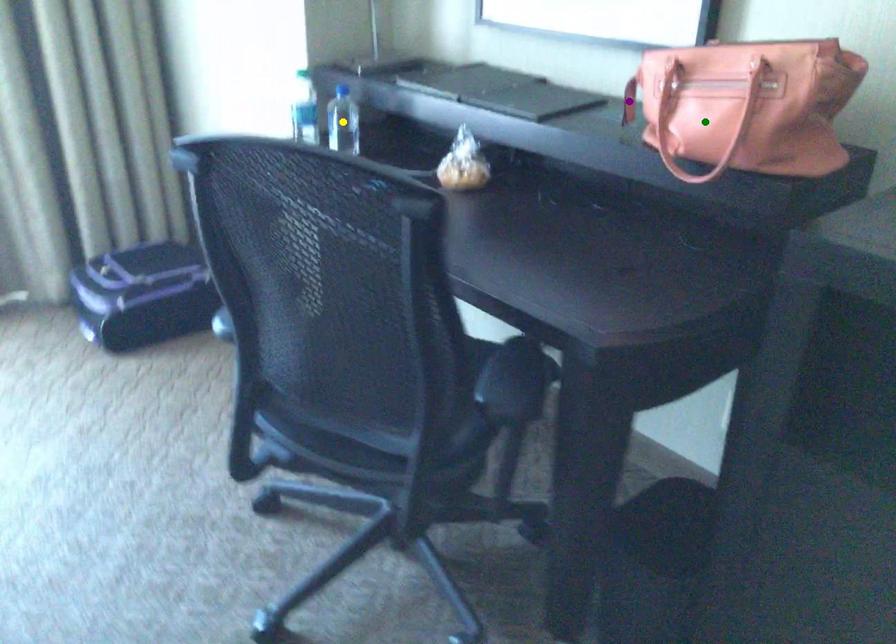
Order these from nearest to farthest:
yellow point | purple point | green point

green point → purple point → yellow point